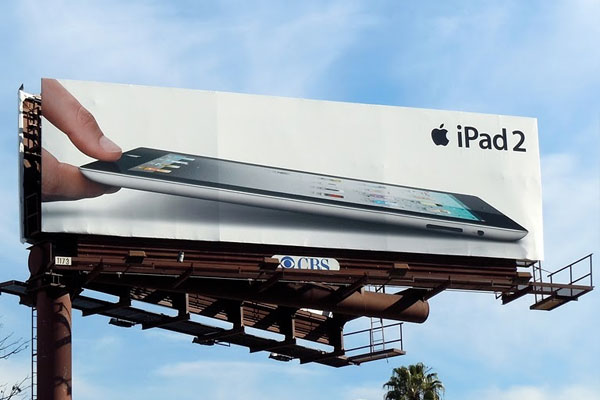
Where is `ipad`? ipad is located at coordinates (175, 190).